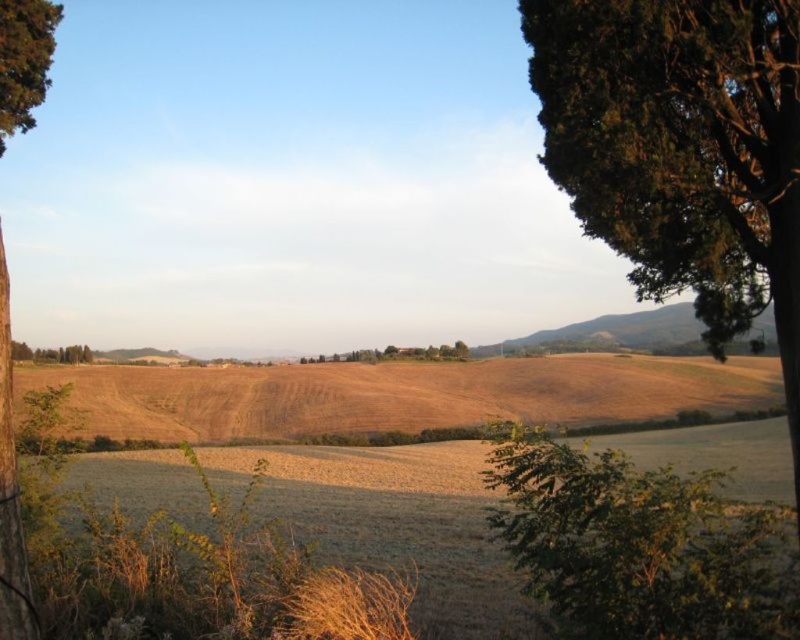
Which is below, green leafy tree at upper left or green leafy tree at center?

Positioned lower is green leafy tree at center.

Between green leafy tree at upper left and green leafy tree at center, which one has more height?

With more height is green leafy tree at upper left.

Is point (41, 54) farther from camera compared to point (370, 352)?

No, it is in front of (370, 352).

Where is `green leafy tree at upper left`? Image resolution: width=800 pixels, height=640 pixels. green leafy tree at upper left is located at coordinates (24, 60).

Where is `green leafy tree at lower right`? This screenshot has width=800, height=640. green leafy tree at lower right is located at coordinates (641, 545).

In the scene shown: Between green leafy tree at right and green leafy tree at upper left, which one is positioned higher?

green leafy tree at upper left is above.

Can you confirm if green leafy tree at right is bigger than green leafy tree at upper left?

Yes, green leafy tree at right is bigger than green leafy tree at upper left.

From the picture: Measure the distance between green leafy tree at right and camera.

A distance of 6.28 meters exists between green leafy tree at right and camera.

This screenshot has width=800, height=640. Identify the location of green leafy tree at right. pos(682,150).